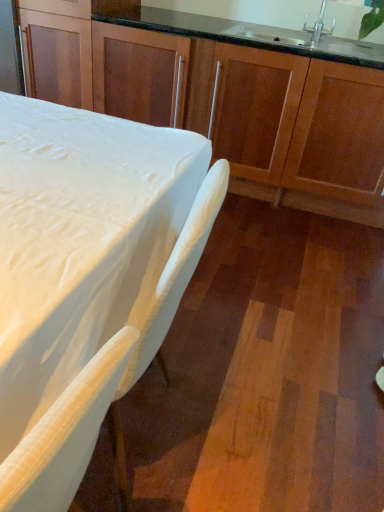
Question: Is white matte table at lower left wider or thinner than wooden cabinets at center?

Choices:
 (A) thin
 (B) wide

Answer: (A)

Question: Do you think white matte table at lower left is within wooden cabinets at center, or outside of it?

Choices:
 (A) outside
 (B) inside

Answer: (A)

Question: Based on their relative distances, which object is farther from the silver metallic faucet at upper right?

Choices:
 (A) white matte table at lower left
 (B) wooden cabinets at center

Answer: (A)

Question: Which is farther from the wooden cabinets at center?

Choices:
 (A) white matte table at lower left
 (B) silver metallic faucet at upper right

Answer: (A)